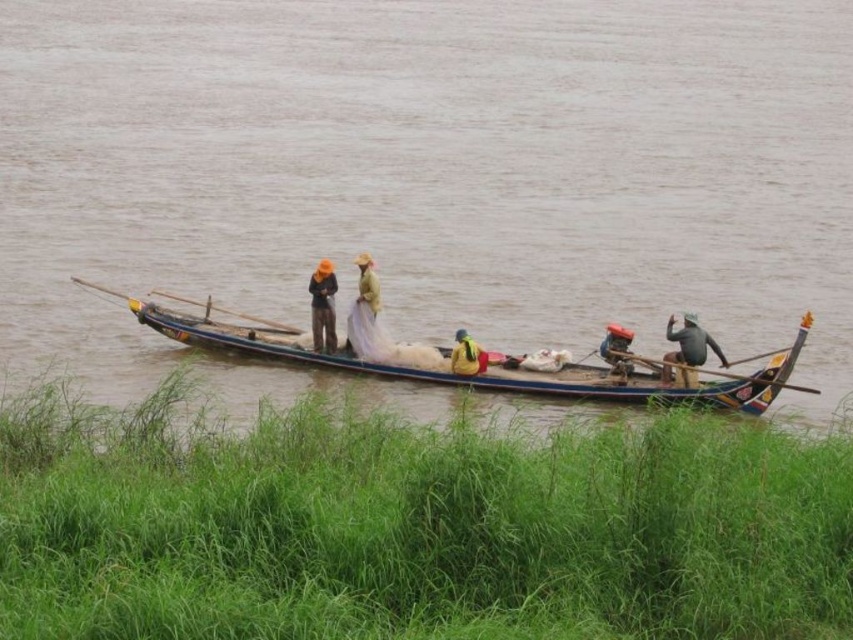
Describe the element at coordinates (428, 172) in the screenshot. I see `brown wooden boat at center` at that location.

Is brown wooden boat at center positioned before matte black jacket at center?

Yes, it is.

In the scene shown: Measure the distance between brown wooden boat at center and camera.

brown wooden boat at center and camera are 34.77 meters apart from each other.

The height and width of the screenshot is (640, 853). I want to click on brown wooden boat at center, so click(428, 172).

Does brown wooden boat at center have a larger size compared to wooden boat at center?

Yes.

Does point (38, 54) come closer to viewer compared to point (344, 362)?

No.

You are a GUI agent. You are given a task and a screenshot of the screen. Output one action in this format:
    pyautogui.click(x=<x>, y=<y>)
    Task: Click on the brown wooden boat at center
    This screenshot has height=640, width=853.
    Given the screenshot: What is the action you would take?
    pyautogui.click(x=428, y=172)

Can you confirm if brown wooden boat at center is smaller than yellow fabric at center?

Incorrect, brown wooden boat at center is not smaller in size than yellow fabric at center.

From the picture: Does brown wooden boat at center lie in front of yellow fabric at center?

That is True.

Who is more forward, (438,339) or (462,337)?

Point (462,337) is more forward.

I want to click on brown wooden boat at center, so click(428, 172).